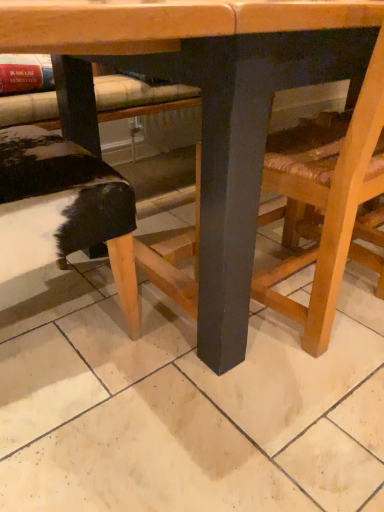
The height and width of the screenshot is (512, 384). Find the location of `free spot in front of wooden chair at lower right`. free spot in front of wooden chair at lower right is located at coordinates (291, 411).